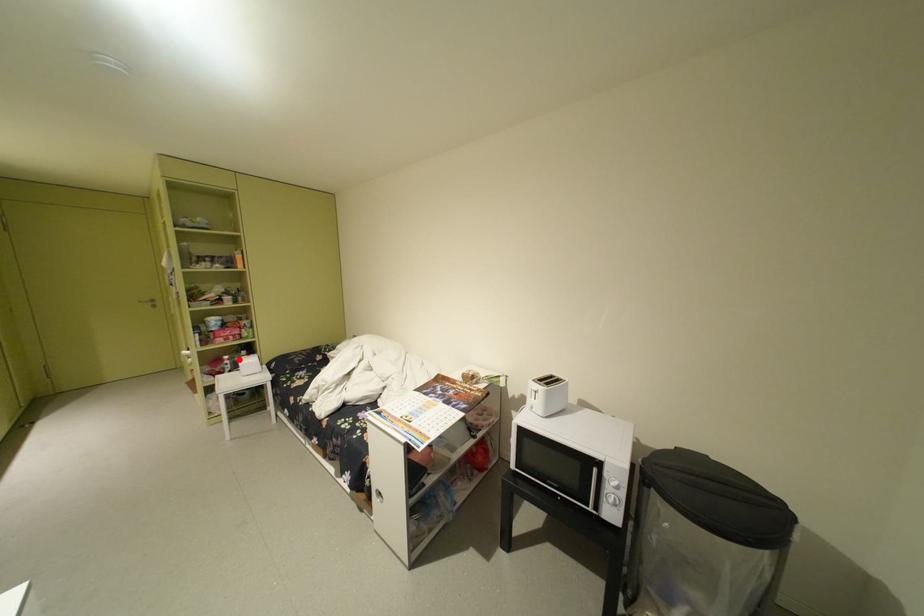
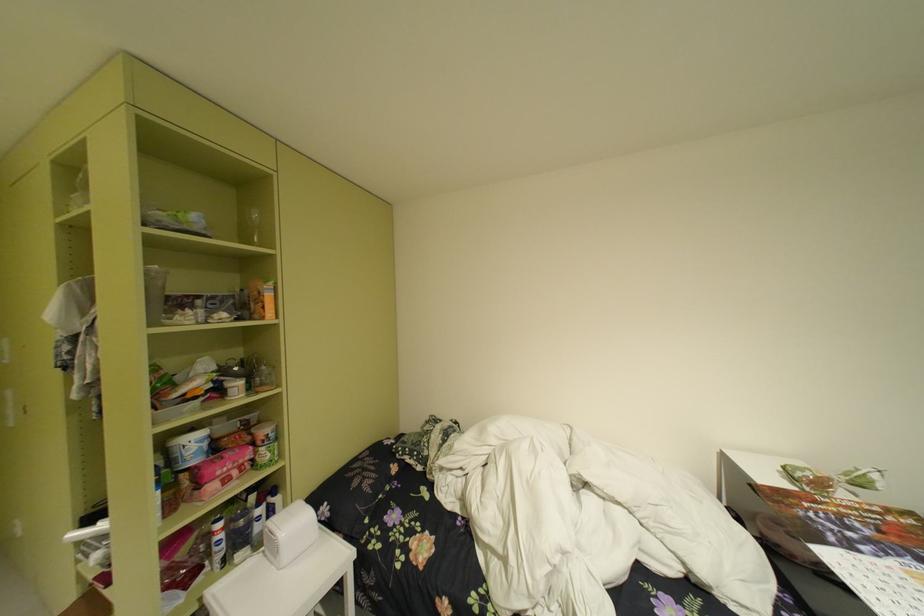
Question: A red point is marked in image1. In image2, is the corresponding 3D point closer to the camera or farther? Reply with the corresponding letter.

Choices:
 (A) The corresponding 3D point is closer.
 (B) The corresponding 3D point is farther.

Answer: (A)